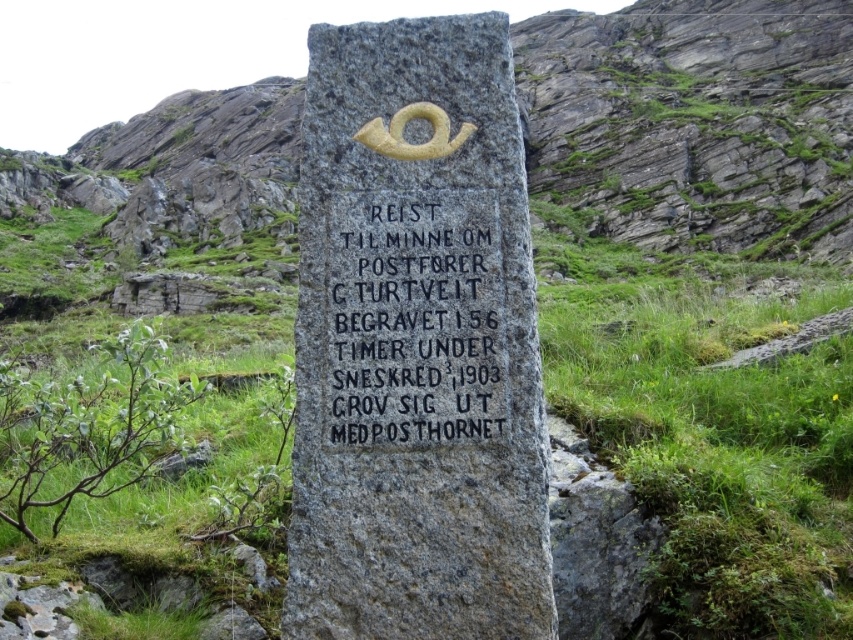
You are a geologist examining the monument and notice two stones. The gray stone monument at center and the black granite stone at center. Which one is taller?

The gray stone monument at center is taller than the black granite stone at center.